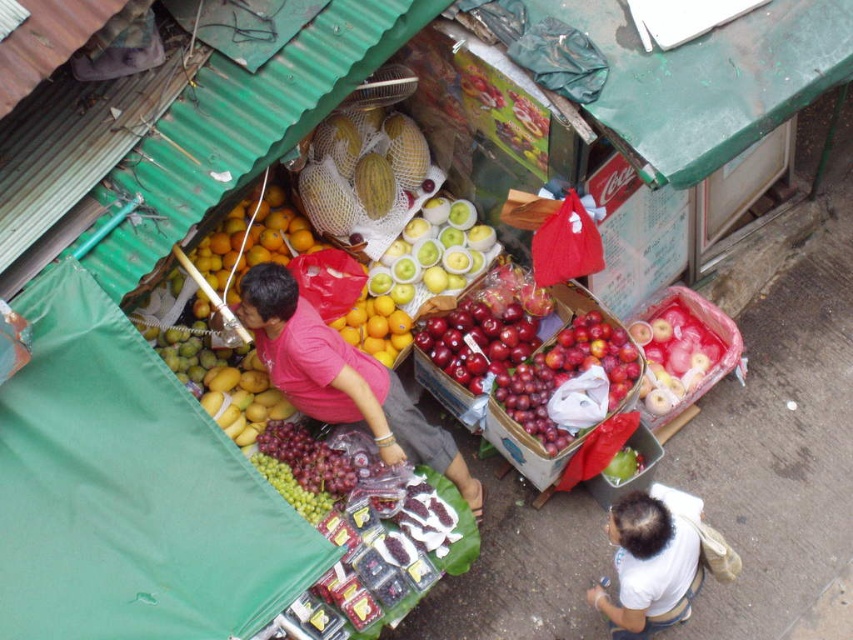
Describe the element at coordinates (341, 378) in the screenshot. The height and width of the screenshot is (640, 853). I see `pink fabric shirt at center` at that location.

The height and width of the screenshot is (640, 853). Describe the element at coordinates (341, 378) in the screenshot. I see `pink fabric shirt at center` at that location.

The width and height of the screenshot is (853, 640). What are the coordinates of `pink fabric shirt at center` in the screenshot? It's located at (341, 378).

Can you confirm if pink fabric shirt at center is positioned above green netted melons at center?

Incorrect, pink fabric shirt at center is not positioned above green netted melons at center.

Does pink fabric shirt at center appear on the right side of green netted melons at center?

Indeed, pink fabric shirt at center is positioned on the right side of green netted melons at center.

Where is `pink fabric shirt at center`? pink fabric shirt at center is located at coordinates (341, 378).

The width and height of the screenshot is (853, 640). Find the location of `pink fabric shirt at center`. pink fabric shirt at center is located at coordinates (341, 378).

Does shiny red apples at center have a larger size compared to yellow matte oranges at center?

No, shiny red apples at center is not bigger than yellow matte oranges at center.

Can you confirm if shiny red apples at center is positioned below yellow matte oranges at center?

Indeed, shiny red apples at center is positioned under yellow matte oranges at center.

Between point (596, 346) and point (292, 237), which one is positioned behind?

Point (292, 237)

Locate an element on the screen. The height and width of the screenshot is (640, 853). shiny red apples at center is located at coordinates (569, 380).